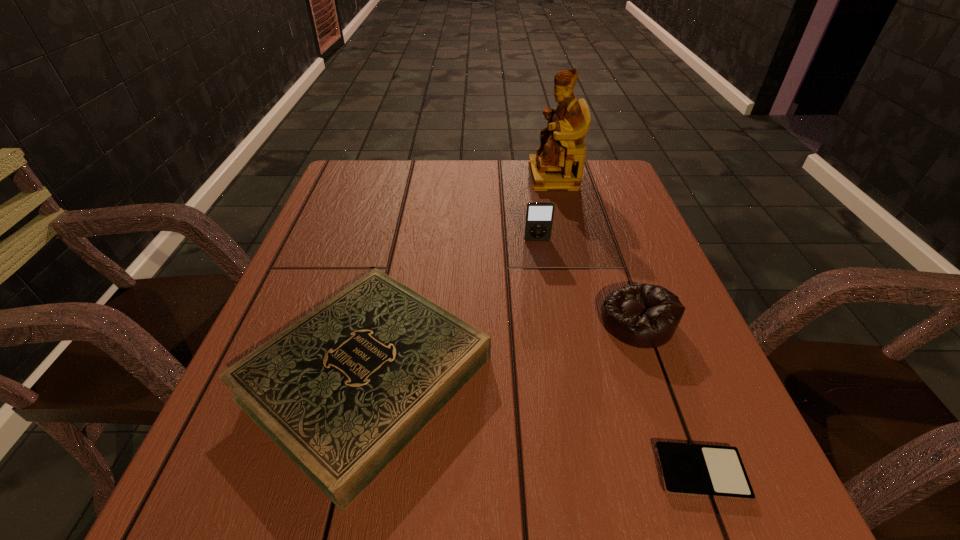
This screenshot has height=540, width=960. What are the coordinates of `blank space at the near left corner` in the screenshot? It's located at (241, 525).

Find the location of a particular element. Image resolution: width=960 pixels, height=540 pixels. free space that is in between the beanbag and the hardback book is located at coordinates (501, 349).

Locate an element on the screen. The width and height of the screenshot is (960, 540). free space between the fourth tallest object and the right iPod is located at coordinates pos(533,424).

Find the location of a particular element. The height and width of the screenshot is (540, 960). free area in between the right iPod and the beanbag is located at coordinates (669, 397).

The image size is (960, 540). Find the location of `empty space that is in between the beanbag and the farthest object`. empty space that is in between the beanbag and the farthest object is located at coordinates (595, 249).

Locate an element on the screen. Image resolution: width=960 pixels, height=540 pixels. unoccupied area between the shortest object and the left iPod is located at coordinates (619, 356).

In order to click on vacant space that's between the hardback book and the left iPod in this screenshot , I will do `click(451, 308)`.

Image resolution: width=960 pixels, height=540 pixels. Identify the location of free space between the hardback book and the shortest object. (533, 424).

Where is `free spot between the second shortest object and the farthest object`? This screenshot has width=960, height=540. free spot between the second shortest object and the farthest object is located at coordinates (459, 276).

Identify the location of empty space between the beanbag and the nearer iPod. (669, 397).